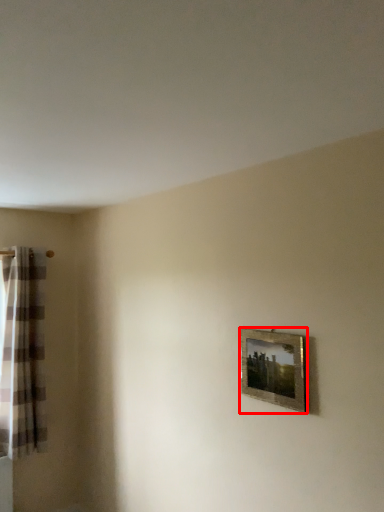
Question: From the image's perspective, where is picture frame (annotated by the red box) located in relation to curtain in the image?

Choices:
 (A) below
 (B) above

Answer: (B)